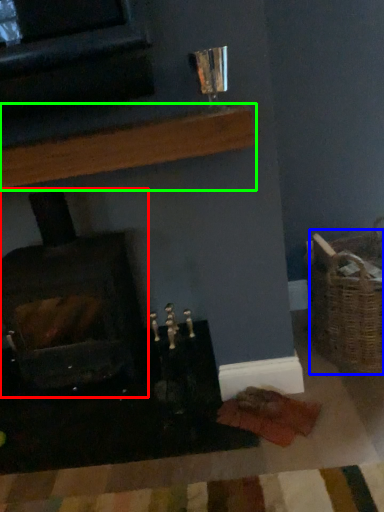
Question: Considering the real-world distances, which object is farthest from wood burning stove (highlighted by a red box)? basket (highlighted by a blue box) or shelf (highlighted by a green box)?

Choices:
 (A) basket
 (B) shelf

Answer: (A)